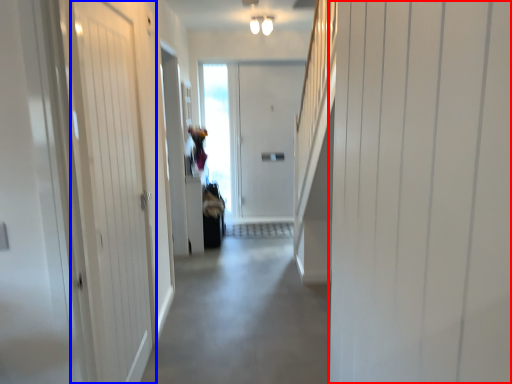
Question: Which object is further to the camera taking this photo, door (highlighted by a red box) or door (highlighted by a blue box)?

Choices:
 (A) door
 (B) door

Answer: (B)